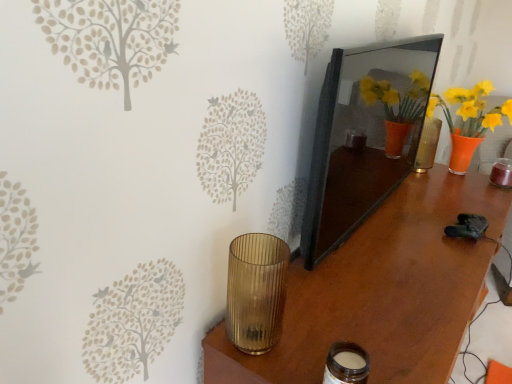
Image resolution: width=512 pixels, height=384 pixels. I want to click on vacant area that lies between matte black mirror at center and matte glass jar at lower center, which appears as the second candle holder when viewed from the left, so click(x=367, y=271).